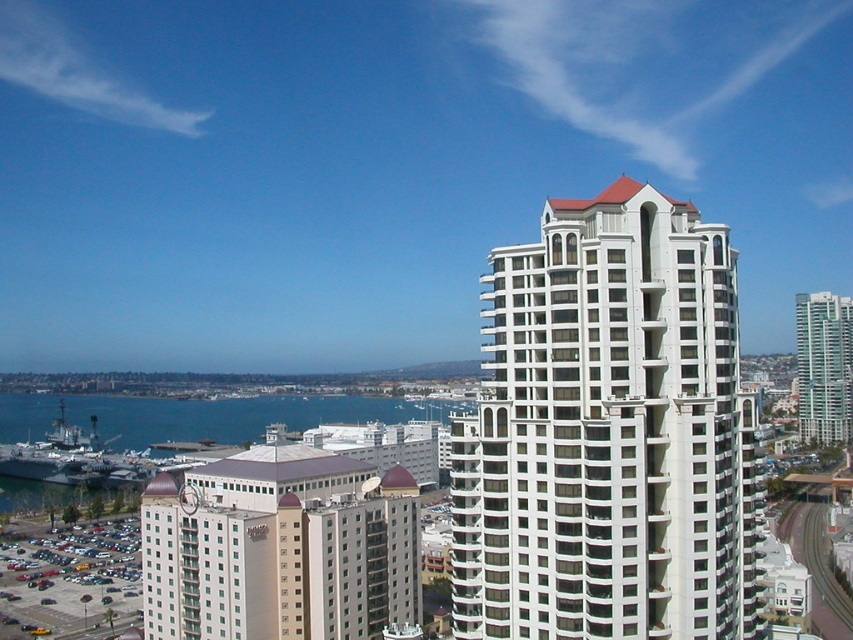
Consider the image. Can you confirm if beige/marble hotel at center is bigger than blue water at lower left?

No.

Can you confirm if beige/marble hotel at center is positioned below blue water at lower left?

Incorrect, beige/marble hotel at center is not positioned below blue water at lower left.

The width and height of the screenshot is (853, 640). I want to click on beige/marble hotel at center, so click(x=279, y=548).

You are a GUI agent. You are given a task and a screenshot of the screen. Output one action in this format:
    pyautogui.click(x=<x>, y=<y>)
    Task: Click on the beige/marble hotel at center
    This screenshot has width=853, height=640.
    Given the screenshot: What is the action you would take?
    pyautogui.click(x=279, y=548)

Consider the image. Between blue water at lower left and smooth glass skyscraper at right, which one appears on the right side from the viewer's perspective?

smooth glass skyscraper at right is more to the right.

Does blue water at lower left have a greater width compared to smooth glass skyscraper at right?

Yes, blue water at lower left is wider than smooth glass skyscraper at right.

Is point (9, 400) more distant than point (813, 413)?

Yes, it is behind point (813, 413).

Where is `blue water at lower left`? This screenshot has width=853, height=640. blue water at lower left is located at coordinates (236, 416).

Can you confirm if white glass building at center is positioned below blue water at lower left?

Incorrect, white glass building at center is not positioned below blue water at lower left.

Between white glass building at center and blue water at lower left, which one appears on the right side from the viewer's perspective?

From the viewer's perspective, white glass building at center appears more on the right side.

The width and height of the screenshot is (853, 640). Find the location of `white glass building at center`. white glass building at center is located at coordinates (606, 433).